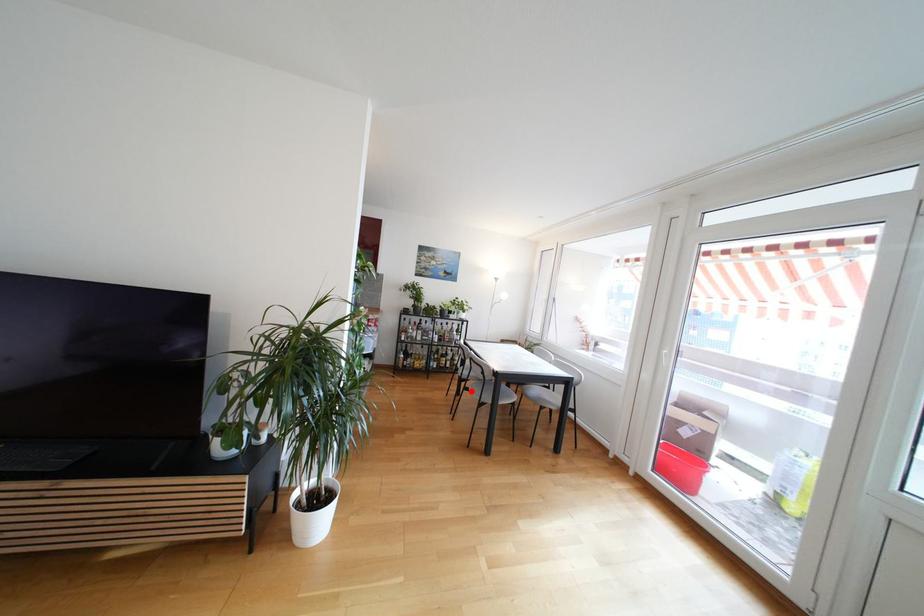
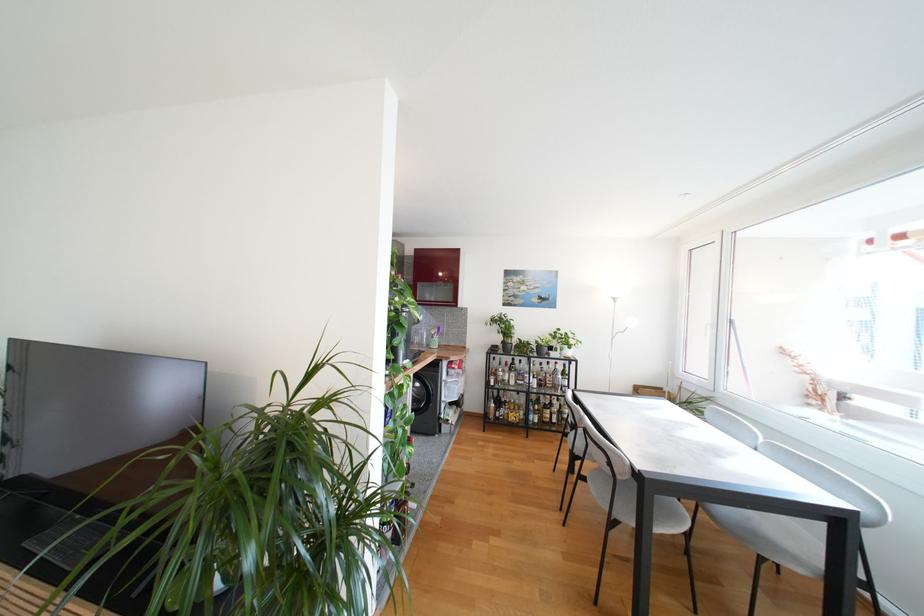
The point at the highlighted location is marked in the first image. Where is the corresponding point in the second image?

(589, 480)